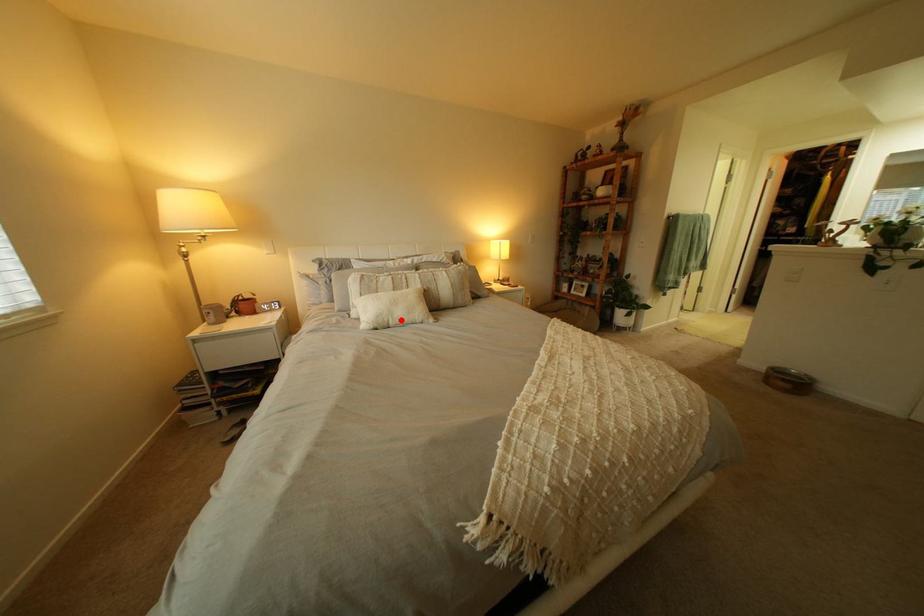
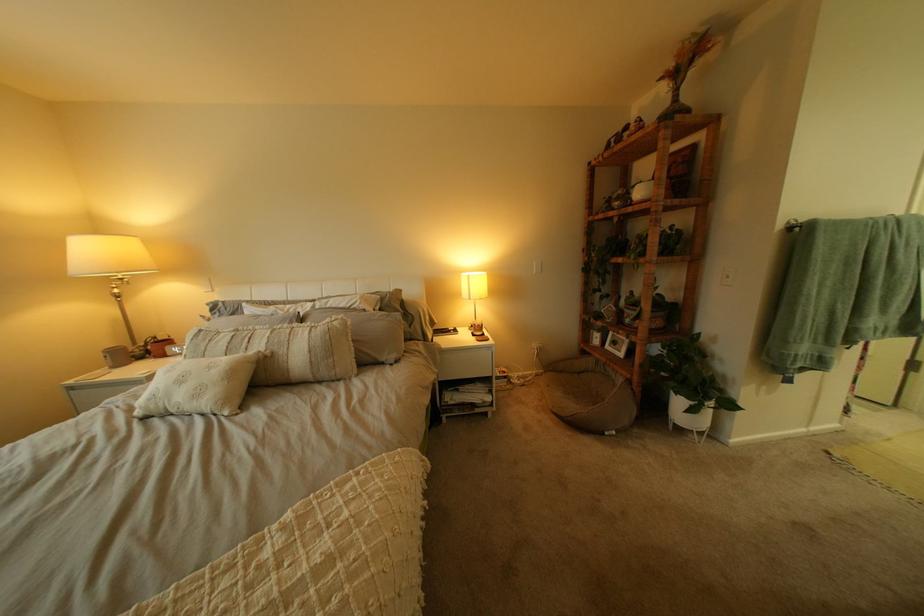
Where in the second image is the point corresponding to the highlighted location from the first image?

(176, 405)